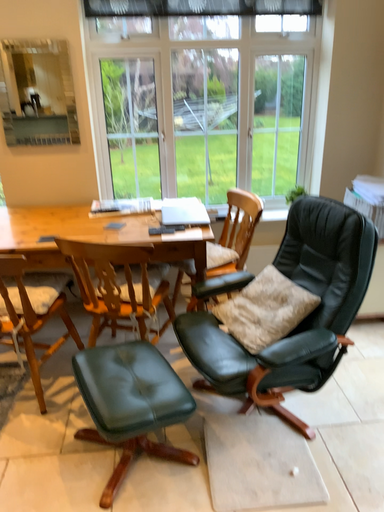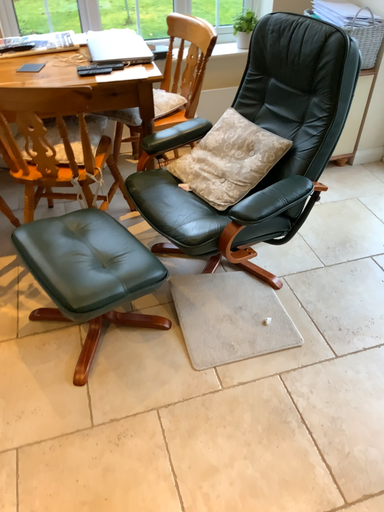
Question: Which way did the camera rotate in the video?

Choices:
 (A) rotated right
 (B) rotated left

Answer: (A)